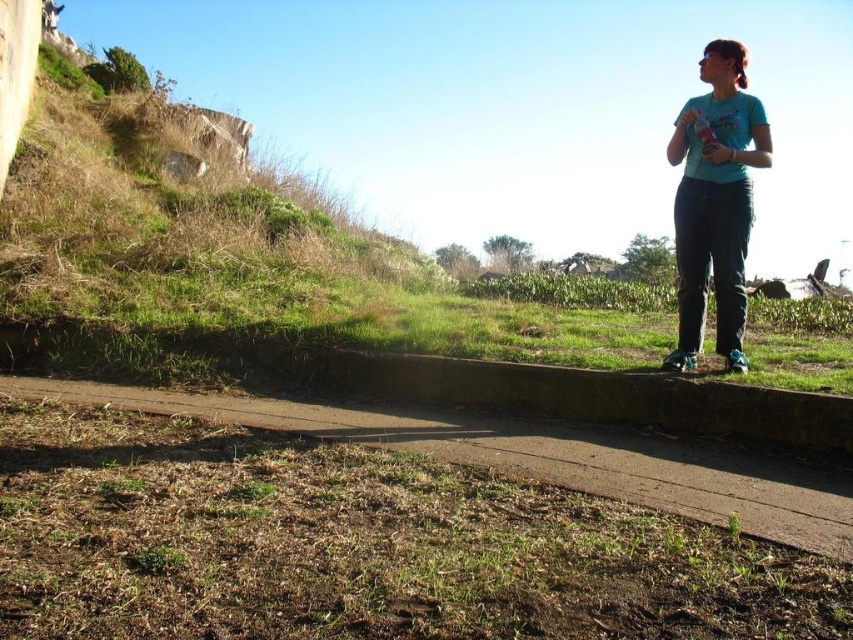
You are standing at the origin point of the image coordinate system. You need to walk to the brown concrete path at center. Which direction should you move in to reach it?

Since the brown concrete path at center is located at coordinate point 0.713 on the x axis and 0.633 on the y axis, you should move towards the right and upward direction to reach it.

You are standing at the point marked as point (538, 456) in the image. Looking around, you see the brown concrete path at center. Where is the brown concrete path at center relative to your current position?

The brown concrete path at center is located at point (538, 456), which is your current position. So you are standing right on the brown concrete path at center.

You are standing at the point labeled point (706,476) and want to walk towards the point labeled point (717,353). Which direction should you face to move towards it?

Since point (706,476) is closer to the viewer than point (717,353), you should face towards the direction away from the viewer to reach point (717,353).